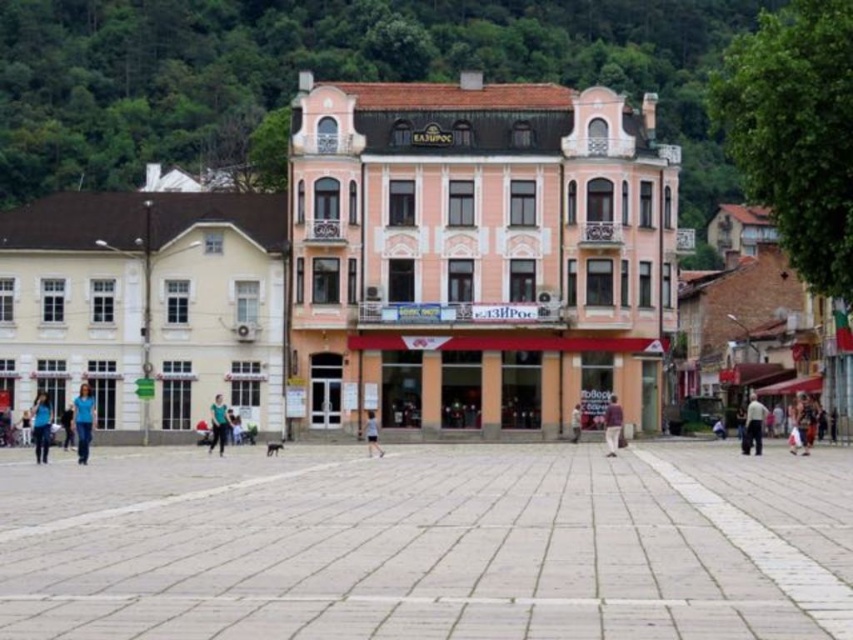
You are standing in the square and notice the gray stone pavement at center and the light brown leather pants at lower right. Which object is located higher in the image?

The gray stone pavement at center is above the light brown leather pants at lower right, so it is higher in the image.

You are a delivery person with a cart that is 1.2 meters wide. You need to navigate through the gray stone pavement at center and the light brown leather pants at lower right. Can your cart fit through the narrower path between them?

The gray stone pavement at center is wider than the light brown leather pants at lower right. Since the cart is 1.2 meters wide, it can only fit through the wider path of the gray stone pavement at center, not the narrower light brown leather pants at lower right.